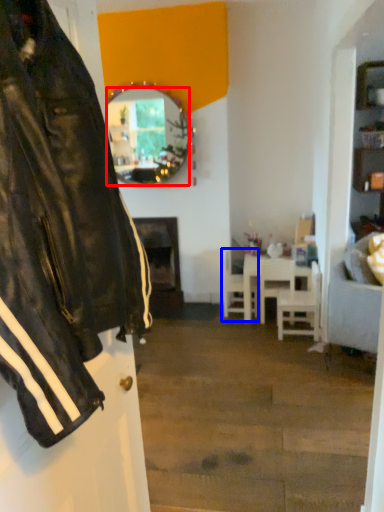
Question: Among these objects, which one is nearest to the camera, mirror (highlighted by a red box) or chair (highlighted by a blue box)?

Choices:
 (A) mirror
 (B) chair

Answer: (A)